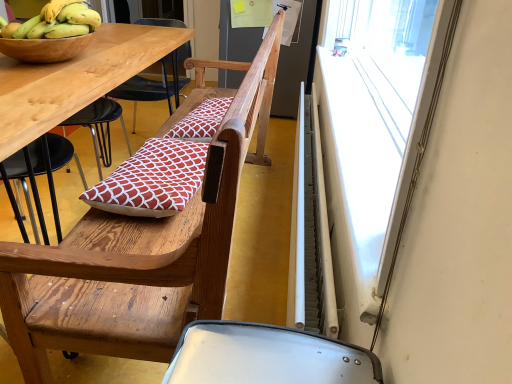
Question: From the image's perspective, is white plastic window screen at upper right below white metallic radiator at right?

Choices:
 (A) no
 (B) yes

Answer: (A)

Question: Does white plastic window screen at upper right appear on the right side of white metallic radiator at right?

Choices:
 (A) yes
 (B) no

Answer: (A)

Question: Considering the relative positions of white plastic window screen at upper right and white metallic radiator at right in the image provided, is white plastic window screen at upper right behind white metallic radiator at right?

Choices:
 (A) yes
 (B) no

Answer: (B)

Question: Is white plastic window screen at upper right positioned in front of white metallic radiator at right?

Choices:
 (A) yes
 (B) no

Answer: (A)

Question: Is white plastic window screen at upper right bigger than white metallic radiator at right?

Choices:
 (A) yes
 (B) no

Answer: (B)

Question: From a real-world perspective, is white plastic window screen at upper right physically below white metallic radiator at right?

Choices:
 (A) yes
 (B) no

Answer: (B)

Question: Does red printed cushion at center, the 2th pillow from the top, have a greater width compared to yellow bananas at upper left?

Choices:
 (A) no
 (B) yes

Answer: (B)

Question: Can you confirm if red printed cushion at center, the first pillow positioned from the bottom, is positioned to the right of yellow bananas at upper left?

Choices:
 (A) no
 (B) yes

Answer: (B)

Question: Is red printed cushion at center, the 2th pillow from the top, to the left of yellow bananas at upper left from the viewer's perspective?

Choices:
 (A) no
 (B) yes

Answer: (A)

Question: Is red printed cushion at center, acting as the first pillow starting from the front, bigger than yellow bananas at upper left?

Choices:
 (A) no
 (B) yes

Answer: (B)

Question: From the image's perspective, is red printed cushion at center, arranged as the second pillow when viewed from the back, under yellow bananas at upper left?

Choices:
 (A) yes
 (B) no

Answer: (A)

Question: Does red printed cushion at center, acting as the first pillow starting from the front, have a lesser height compared to yellow bananas at upper left?

Choices:
 (A) no
 (B) yes

Answer: (B)

Question: Is yellow bananas at upper left surrounding white plastic window screen at upper right?

Choices:
 (A) no
 (B) yes

Answer: (A)